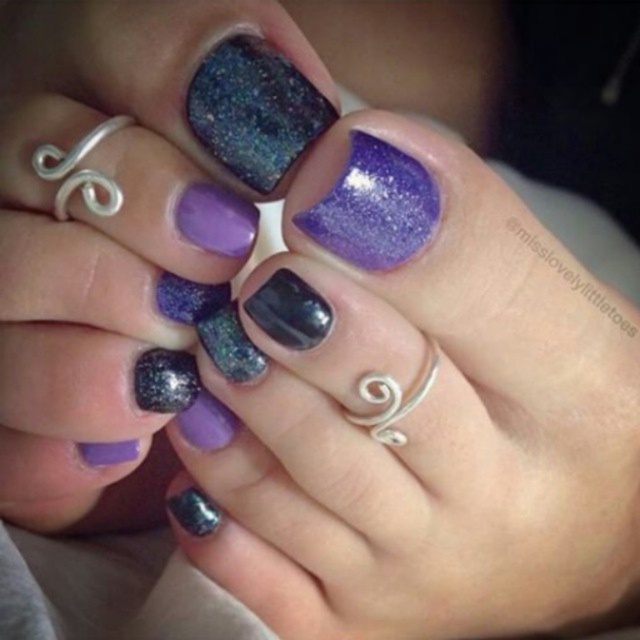
Does glittery metallic nail polish at center lie in front of sparkly black nail polish at center?

Yes, glittery metallic nail polish at center is closer to the viewer.

Which is behind, point (193, 413) or point (193, 522)?

Positioned behind is point (193, 522).

Where is `glittery metallic nail polish at center`? This screenshot has height=640, width=640. glittery metallic nail polish at center is located at coordinates (108, 241).

Is purple glitter nail at center wider than glittery metallic nail polish at center?

Yes, purple glitter nail at center is wider than glittery metallic nail polish at center.

Between purple glitter nail at center and glittery metallic nail polish at center, which one is positioned higher?

glittery metallic nail polish at center

Is point (600, 285) more distant than point (131, 164)?

Yes.

The width and height of the screenshot is (640, 640). Identify the location of purple glitter nail at center. (422, 416).

The width and height of the screenshot is (640, 640). Describe the element at coordinates (422, 416) in the screenshot. I see `purple glitter nail at center` at that location.

Does purple glitter nail at center appear on the right side of sparkly black nail polish at center?

Yes, purple glitter nail at center is to the right of sparkly black nail polish at center.

Find the location of `purple glitter nail at center`. purple glitter nail at center is located at coordinates [422, 416].